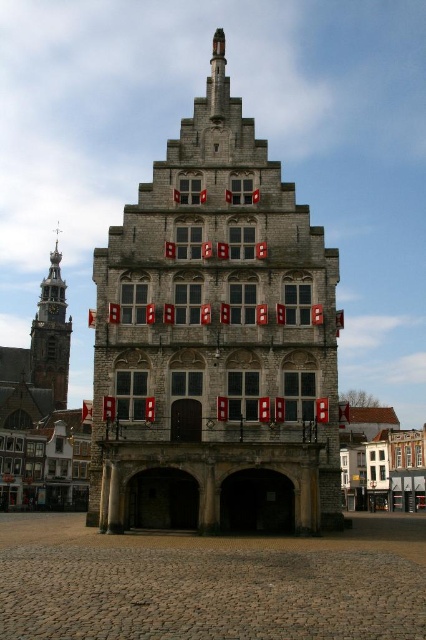
Question: Does stone medieval building at center have a lesser width compared to gold spire at left?

Choices:
 (A) no
 (B) yes

Answer: (B)

Question: Among these objects, which one is nearest to the camera?

Choices:
 (A) stone medieval building at center
 (B) gold spire at left

Answer: (A)

Question: Which object is closer to the camera taking this photo?

Choices:
 (A) gold spire at left
 (B) stone medieval building at center

Answer: (B)

Question: Can you confirm if stone medieval building at center is wider than gold spire at left?

Choices:
 (A) yes
 (B) no

Answer: (B)

Question: Is stone medieval building at center below gold spire at left?

Choices:
 (A) yes
 (B) no

Answer: (B)